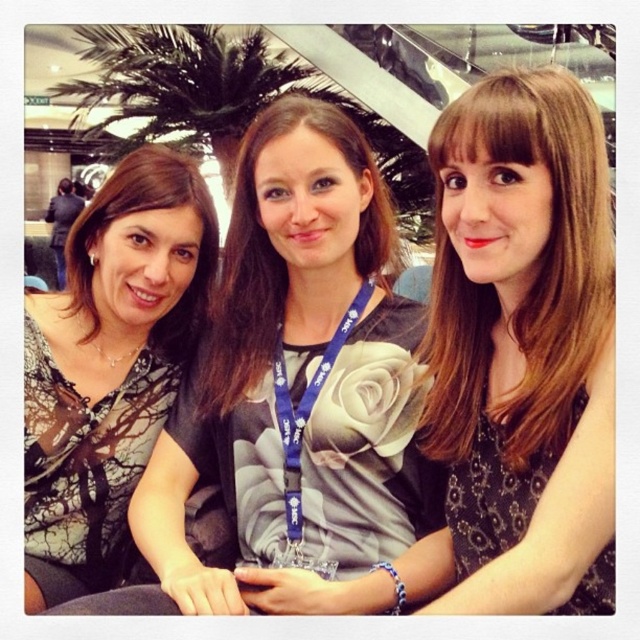
Is matte gray dress at center wider than blue fabric lanyard at center?

Yes, matte gray dress at center is wider than blue fabric lanyard at center.

Image resolution: width=640 pixels, height=640 pixels. What do you see at coordinates (276, 252) in the screenshot? I see `matte gray dress at center` at bounding box center [276, 252].

Locate an element on the screen. The image size is (640, 640). matte gray dress at center is located at coordinates (276, 252).

What do you see at coordinates (316, 348) in the screenshot? I see `matte black dress at center` at bounding box center [316, 348].

Is matte black dress at center shorter than blue fabric lanyard at center?

In fact, matte black dress at center may be taller than blue fabric lanyard at center.

Is point (371, 348) positioned before point (371, 292)?

That is True.

The image size is (640, 640). In order to click on matte black dress at center in this screenshot , I will do `click(316, 348)`.

The width and height of the screenshot is (640, 640). Identify the location of smooth black dress at center. (524, 346).

Can you confirm if smooth black dress at center is taller than blue fabric lanyard at center?

Correct, smooth black dress at center is much taller as blue fabric lanyard at center.

Who is more distant from viewer, [456,468] or [307,396]?

The point [307,396] is more distant.

Where is `smooth black dress at center`? The width and height of the screenshot is (640, 640). smooth black dress at center is located at coordinates (524, 346).